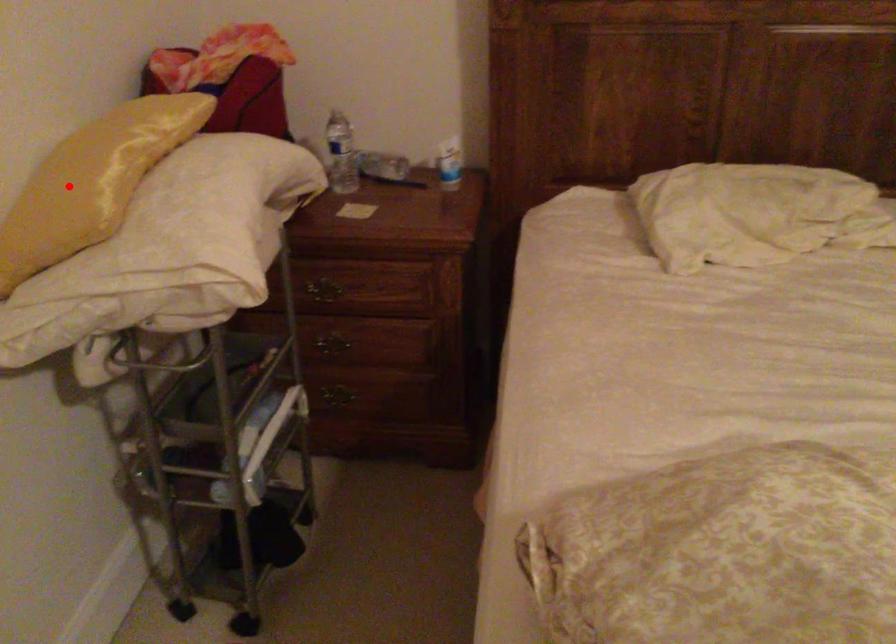
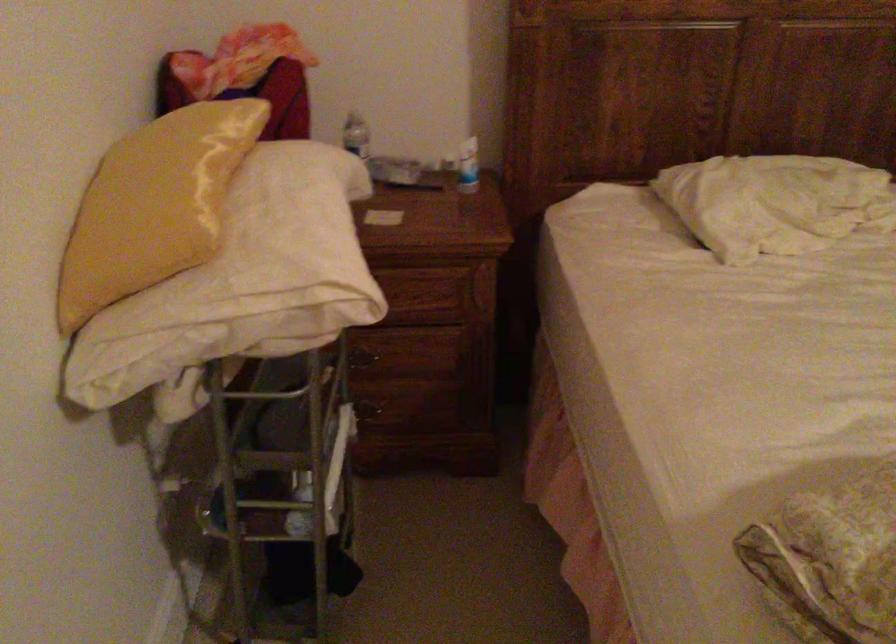
In the second image, find the point that corresponds to the highlighted location in the first image.

(153, 205)